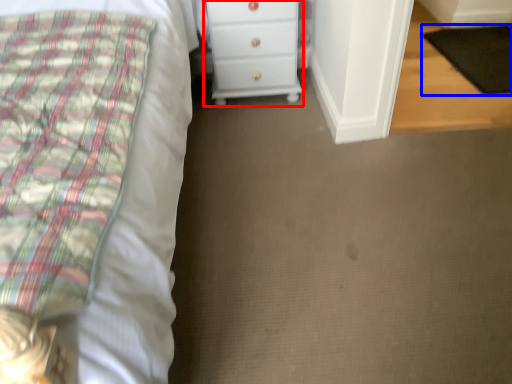
Question: Among these objects, which one is farthest to the camera, chest of drawers (highlighted by a red box) or pad (highlighted by a blue box)?

Choices:
 (A) chest of drawers
 (B) pad

Answer: (B)